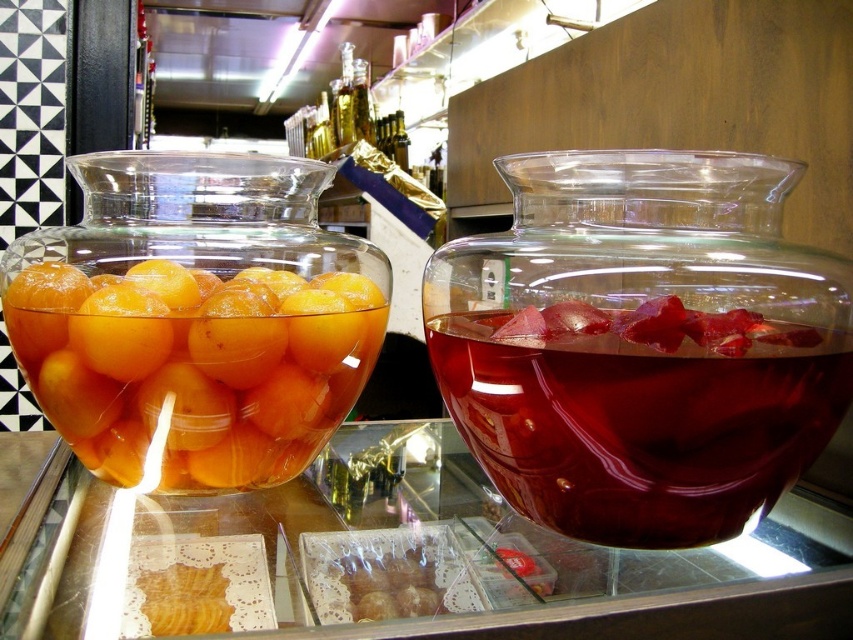
In the scene shown: You are a customer at a bakery and want to buy the larger jar between the transparent glass jar at right and the matte yellow orange at left. Which one should you choose?

The transparent glass jar at right is bigger than the matte yellow orange at left, so you should choose the transparent glass jar at right.

You are a customer at a bakery and want to buy the jar that can hold more liquid. Based on the image, which jar should you choose between the transparent glass jar at right and the matte orange at center?

The transparent glass jar at right is larger in size than the matte orange at center, so it can hold more liquid and is the better choice.

You are a customer at a bakery and want to choose between the transparent glass jar at right and the matte yellow orange at left. Which one is positioned lower on the shelf?

The transparent glass jar at right is positioned lower than the matte yellow orange at left.